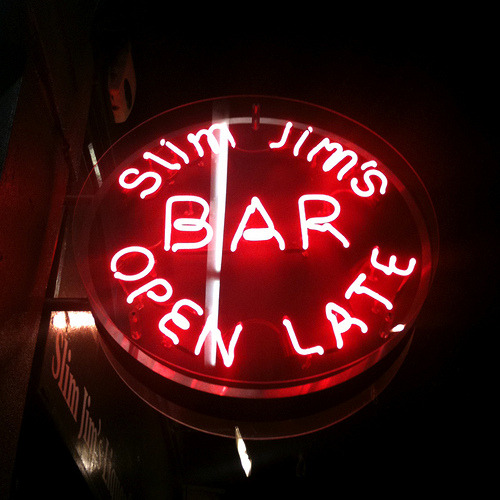
Locate an element on the screen. above neon sign is located at coordinates (250, 61).